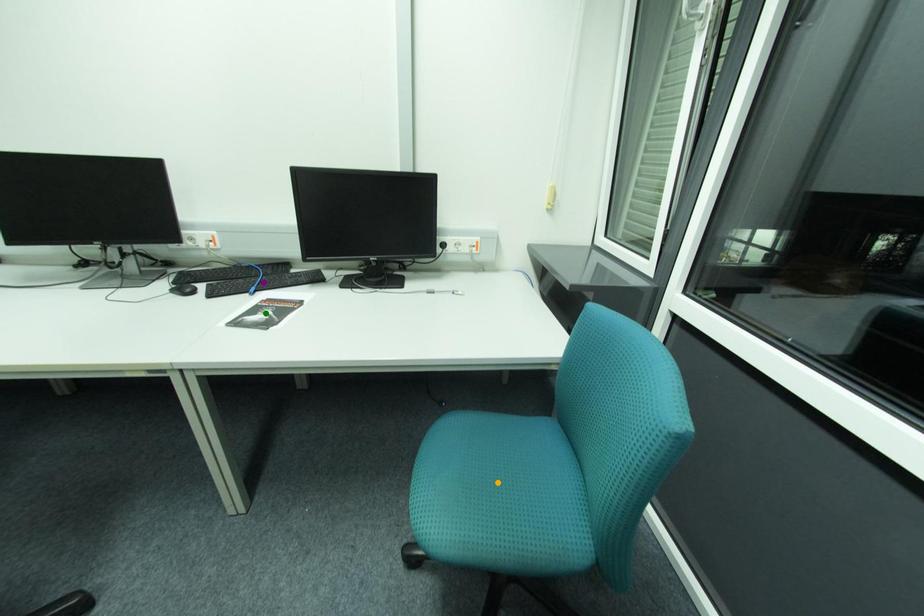
Order these from nearest to farthest:
1. purple point
2. green point
3. orange point

1. orange point
2. purple point
3. green point